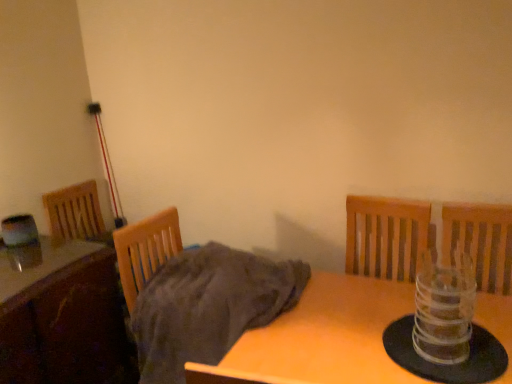
What is the approximate height of wooden table at center, which is the 1th table in right-to-left order?

wooden table at center, which is the 1th table in right-to-left order, is 22.60 inches tall.

Measure the distance between gray cotton blanket at center and camera.

gray cotton blanket at center and camera are 4.26 feet apart from each other.

Find the location of a particular element. The width and height of the screenshot is (512, 384). transparent plastic candle holder at right is located at coordinates (444, 308).

Find the location of `wooden table at center, which is the 1th table in right-to-left order`. wooden table at center, which is the 1th table in right-to-left order is located at coordinates [321, 338].

Considering the relative sizes of wooden table at lower left, which appears as the 1th table when viewed from the left, and wooden table at center, which is the 1th table in right-to-left order, in the image provided, is wooden table at lower left, which appears as the 1th table when viewed from the left, smaller than wooden table at center, which is the 1th table in right-to-left order,?

Correct, wooden table at lower left, which appears as the 1th table when viewed from the left, occupies less space than wooden table at center, which is the 1th table in right-to-left order.

Can you confirm if wooden table at lower left, which appears as the 1th table when viewed from the left, is positioned to the right of wooden table at center, which is the 1th table in right-to-left order?

No, wooden table at lower left, which appears as the 1th table when viewed from the left, is not to the right of wooden table at center, which is the 1th table in right-to-left order.

From a real-world perspective, is wooden table at lower left, positioned as the 2th table in right-to-left order, physically located above or below wooden table at center, which is the 1th table in right-to-left order?

wooden table at lower left, positioned as the 2th table in right-to-left order, is above wooden table at center, which is the 1th table in right-to-left order.

Considering the relative positions of wooden table at center, marked as the second table in a left-to-right arrangement, and gray cotton blanket at center in the image provided, is wooden table at center, marked as the second table in a left-to-right arrangement, to the left or to the right of gray cotton blanket at center?

wooden table at center, marked as the second table in a left-to-right arrangement, is to the right of gray cotton blanket at center.

From a real-world perspective, is wooden table at center, which is the 1th table in right-to-left order, located beneath gray cotton blanket at center?

Yes, from a real-world perspective, wooden table at center, which is the 1th table in right-to-left order, is below gray cotton blanket at center.

Which is less distant, (283, 346) or (185, 268)?

Point (283, 346)

Is wooden table at center, marked as the second table in a left-to-right arrangement, not near gray cotton blanket at center?

No, wooden table at center, marked as the second table in a left-to-right arrangement, is not far from gray cotton blanket at center.

Which is behind, point (167, 301) or point (91, 277)?

The point (91, 277) is farther from the camera.

Image resolution: width=512 pixels, height=384 pixels. What are the coordinates of `table on the left of gray cotton blanket at center` in the screenshot? It's located at (66, 322).

Are gray cotton blanket at center and wooden table at lower left, which appears as the 1th table when viewed from the left, located far from each other?

Actually, gray cotton blanket at center and wooden table at lower left, which appears as the 1th table when viewed from the left, are a little close together.

How different are the orientations of gray cotton blanket at center and wooden table at lower left, positioned as the 2th table in right-to-left order, in degrees?

The angular difference between gray cotton blanket at center and wooden table at lower left, positioned as the 2th table in right-to-left order, is 7.31 degrees.

Where is `table that is the 1st one when counting downward from the transparent plastic candle holder at right (from the image's perspective)`? The height and width of the screenshot is (384, 512). table that is the 1st one when counting downward from the transparent plastic candle holder at right (from the image's perspective) is located at coordinates (66, 322).

Considering their positions, is transparent plastic candle holder at right located in front of or behind wooden table at lower left, positioned as the 2th table in right-to-left order?

transparent plastic candle holder at right is in front of wooden table at lower left, positioned as the 2th table in right-to-left order.

From the image's perspective, is transparent plastic candle holder at right above or below wooden table at lower left, which appears as the 1th table when viewed from the left?

transparent plastic candle holder at right is above wooden table at lower left, which appears as the 1th table when viewed from the left.

Is point (461, 344) positioned before point (72, 298)?

That is True.

Is wooden table at lower left, which appears as the 1th table when viewed from the left, facing away from gray cotton blanket at center?

No, gray cotton blanket at center is not at the back of wooden table at lower left, which appears as the 1th table when viewed from the left.

Does wooden table at lower left, positioned as the 2th table in right-to-left order, have a smaller size compared to gray cotton blanket at center?

No, wooden table at lower left, positioned as the 2th table in right-to-left order, is not smaller than gray cotton blanket at center.

Looking at this image, is wooden table at lower left, positioned as the 2th table in right-to-left order, not inside gray cotton blanket at center?

wooden table at lower left, positioned as the 2th table in right-to-left order, is positioned outside gray cotton blanket at center.

Is the surface of wooden table at lower left, positioned as the 2th table in right-to-left order, in direct contact with gray cotton blanket at center?

No, wooden table at lower left, positioned as the 2th table in right-to-left order, is not in contact with gray cotton blanket at center.

Could you measure the distance between wooden table at center, marked as the second table in a left-to-right arrangement, and transparent plastic candle holder at right?

A distance of 10.75 inches exists between wooden table at center, marked as the second table in a left-to-right arrangement, and transparent plastic candle holder at right.

From the image's perspective, is wooden table at center, marked as the second table in a left-to-right arrangement, on top of transparent plastic candle holder at right?

No.

Considering the relative sizes of wooden table at center, marked as the second table in a left-to-right arrangement, and transparent plastic candle holder at right in the image provided, is wooden table at center, marked as the second table in a left-to-right arrangement, smaller than transparent plastic candle holder at right?

Incorrect, wooden table at center, marked as the second table in a left-to-right arrangement, is not smaller in size than transparent plastic candle holder at right.

Which object is further away from the camera taking this photo, wooden table at center, which is the 1th table in right-to-left order, or transparent plastic candle holder at right?

transparent plastic candle holder at right is further from the camera.

Is gray cotton blanket at center positioned before transparent plastic candle holder at right?

That is False.

I want to click on blanket below the transparent plastic candle holder at right (from the image's perspective), so click(x=208, y=307).

Is gray cotton blanket at center positioned with its back to transparent plastic candle holder at right?

No, gray cotton blanket at center's orientation is not away from transparent plastic candle holder at right.

Is gray cotton blanket at center located outside transparent plastic candle holder at right?

Yes, gray cotton blanket at center is not within transparent plastic candle holder at right.

Locate an element on the screen. table above the wooden table at center, marked as the second table in a left-to-right arrangement (from a real-world perspective) is located at coordinates (66, 322).

Where is `table that appears on the right of gray cotton blanket at center`? table that appears on the right of gray cotton blanket at center is located at coordinates point(321,338).

Based on their spatial positions, is gray cotton blanket at center or wooden table at center, marked as the second table in a left-to-right arrangement, further from transparent plastic candle holder at right?

The object further to transparent plastic candle holder at right is gray cotton blanket at center.

When comparing their distances from wooden table at lower left, which appears as the 1th table when viewed from the left, does transparent plastic candle holder at right or gray cotton blanket at center seem closer?

gray cotton blanket at center.

When comparing their distances from wooden table at lower left, which appears as the 1th table when viewed from the left, does transparent plastic candle holder at right or wooden table at center, which is the 1th table in right-to-left order, seem further?

transparent plastic candle holder at right lies further to wooden table at lower left, which appears as the 1th table when viewed from the left, than the other object.

Looking at the image, which one is located further to wooden table at center, marked as the second table in a left-to-right arrangement, gray cotton blanket at center or wooden table at lower left, which appears as the 1th table when viewed from the left?

wooden table at lower left, which appears as the 1th table when viewed from the left, is further to wooden table at center, marked as the second table in a left-to-right arrangement.

Which object lies nearer to the anchor point wooden table at lower left, positioned as the 2th table in right-to-left order, gray cotton blanket at center or wooden table at center, which is the 1th table in right-to-left order?

gray cotton blanket at center lies closer to wooden table at lower left, positioned as the 2th table in right-to-left order, than the other object.

Considering their positions, is wooden table at lower left, positioned as the 2th table in right-to-left order, positioned further to gray cotton blanket at center than wooden table at center, which is the 1th table in right-to-left order?

The object further to gray cotton blanket at center is wooden table at lower left, positioned as the 2th table in right-to-left order.

When comparing their distances from gray cotton blanket at center, does wooden table at center, which is the 1th table in right-to-left order, or wooden table at lower left, positioned as the 2th table in right-to-left order, seem closer?

Based on the image, wooden table at center, which is the 1th table in right-to-left order, appears to be nearer to gray cotton blanket at center.

Based on their spatial positions, is gray cotton blanket at center or transparent plastic candle holder at right further from wooden table at center, which is the 1th table in right-to-left order?

transparent plastic candle holder at right is further to wooden table at center, which is the 1th table in right-to-left order.

Where is `blanket located between wooden table at lower left, which appears as the 1th table when viewed from the left, and transparent plastic candle holder at right in the left-right direction`? Image resolution: width=512 pixels, height=384 pixels. blanket located between wooden table at lower left, which appears as the 1th table when viewed from the left, and transparent plastic candle holder at right in the left-right direction is located at coordinates (208, 307).

This screenshot has height=384, width=512. What are the coordinates of `table located between wooden table at lower left, positioned as the 2th table in right-to-left order, and transparent plastic candle holder at right in the left-right direction` in the screenshot? It's located at (321, 338).

Where is `blanket between wooden table at lower left, positioned as the 2th table in right-to-left order, and wooden table at center, marked as the second table in a left-to-right arrangement`? The height and width of the screenshot is (384, 512). blanket between wooden table at lower left, positioned as the 2th table in right-to-left order, and wooden table at center, marked as the second table in a left-to-right arrangement is located at coordinates (208, 307).

The width and height of the screenshot is (512, 384). Find the location of `table situated between gray cotton blanket at center and transparent plastic candle holder at right from left to right`. table situated between gray cotton blanket at center and transparent plastic candle holder at right from left to right is located at coordinates (321, 338).